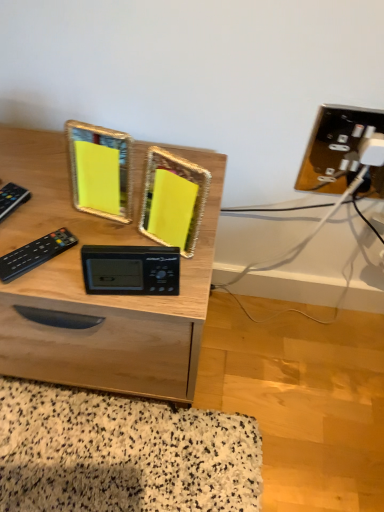
Question: Is black plastic remote at left, the first control viewed from the right, at the right side of black plastic clock at center?

Choices:
 (A) no
 (B) yes

Answer: (A)

Question: Is black plastic remote at left, the first control viewed from the right, smaller than black plastic clock at center?

Choices:
 (A) yes
 (B) no

Answer: (A)

Question: Is black plastic remote at left, arranged as the second control when viewed from the left, not close to black plastic clock at center?

Choices:
 (A) yes
 (B) no

Answer: (B)

Question: From the image's perspective, is black plastic remote at left, the first control viewed from the right, below black plastic clock at center?

Choices:
 (A) yes
 (B) no

Answer: (B)

Question: From the image's perspective, is black plastic remote at left, arranged as the second control when viewed from the left, located above black plastic clock at center?

Choices:
 (A) yes
 (B) no

Answer: (A)

Question: In the image, is black plastic remote at left, arranged as the second control when viewed from the left, positioned in front of or behind black plastic remote at left, which ranks as the second control in right-to-left order?

Choices:
 (A) behind
 (B) front

Answer: (B)

Question: From a real-world perspective, is black plastic remote at left, arranged as the second control when viewed from the left, positioned above or below black plastic remote at left, which ranks as the second control in right-to-left order?

Choices:
 (A) below
 (B) above

Answer: (B)

Question: Would you say black plastic remote at left, arranged as the second control when viewed from the left, is to the left or to the right of black plastic remote at left, which ranks as the second control in right-to-left order, in the picture?

Choices:
 (A) left
 (B) right

Answer: (B)

Question: In terms of size, does black plastic remote at left, the first control viewed from the right, appear bigger or smaller than black plastic remote at left, which ranks as the second control in right-to-left order?

Choices:
 (A) big
 (B) small

Answer: (B)

Question: Does point (19, 159) appear closer or farther from the camera than point (61, 229)?

Choices:
 (A) closer
 (B) farther

Answer: (B)

Question: From the image's perspective, is wooden desk at center located above or below black plastic remote at left, the first control viewed from the right?

Choices:
 (A) below
 (B) above

Answer: (A)

Question: Considering their positions, is wooden desk at center located in front of or behind black plastic remote at left, the first control viewed from the right?

Choices:
 (A) front
 (B) behind

Answer: (A)

Question: Considering the positions of wooden desk at center and black plastic remote at left, arranged as the second control when viewed from the left, in the image, is wooden desk at center taller or shorter than black plastic remote at left, arranged as the second control when viewed from the left,?

Choices:
 (A) tall
 (B) short

Answer: (A)

Question: Looking at their shapes, would you say wooden desk at center is wider or thinner than black plastic remote at left, which ranks as the second control in right-to-left order?

Choices:
 (A) thin
 (B) wide

Answer: (B)

Question: Does point (13, 238) appear closer or farther from the camera than point (16, 203)?

Choices:
 (A) closer
 (B) farther

Answer: (A)